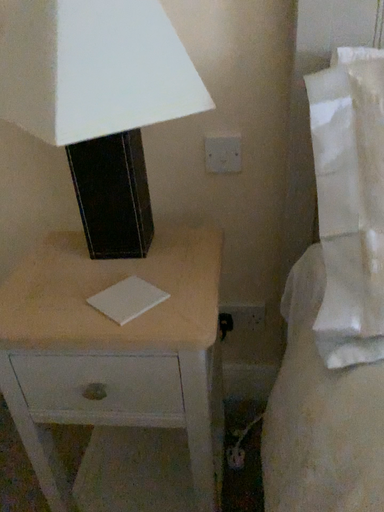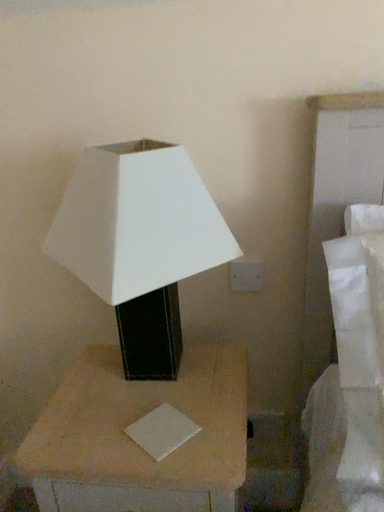
Question: Which way did the camera rotate in the video?

Choices:
 (A) rotated downward
 (B) rotated upward

Answer: (B)